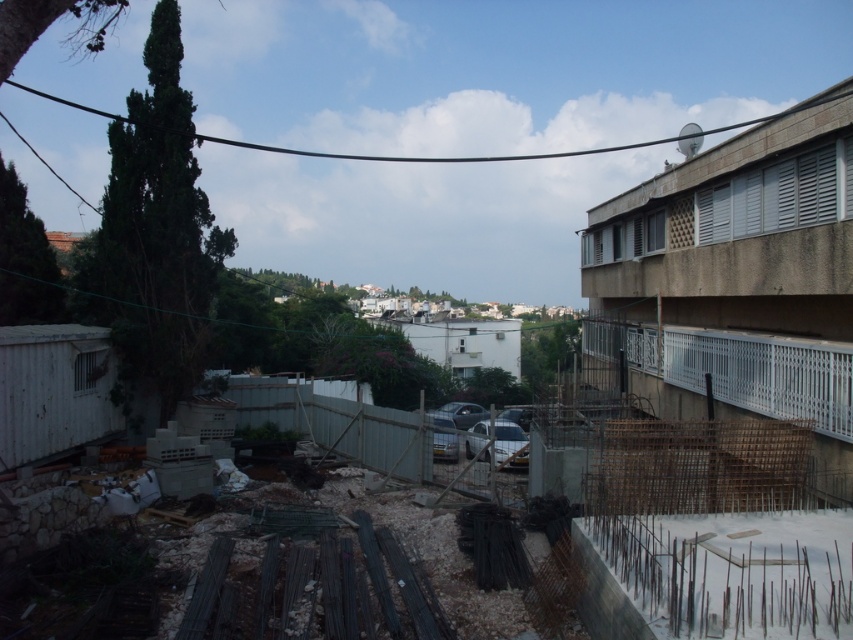
Question: Estimate the real-world distances between objects in this image. Which object is farther from the white metal fence at right?

Choices:
 (A) white glossy car at center
 (B) metallic silver car at center
 (C) shiny silver car at center

Answer: (C)

Question: Is white metal fence at right to the left of shiny silver car at center from the viewer's perspective?

Choices:
 (A) yes
 (B) no

Answer: (B)

Question: Among these objects, which one is nearest to the camera?

Choices:
 (A) white metal fence at right
 (B) white glossy car at center

Answer: (A)

Question: Does white metal fence at right have a greater width compared to white glossy car at center?

Choices:
 (A) no
 (B) yes

Answer: (A)

Question: Is white metal fence at right in front of shiny silver car at center?

Choices:
 (A) no
 (B) yes

Answer: (B)

Question: Which of the following is the closest to the observer?

Choices:
 (A) white glossy car at center
 (B) metallic silver car at center
 (C) white metal fence at right

Answer: (C)